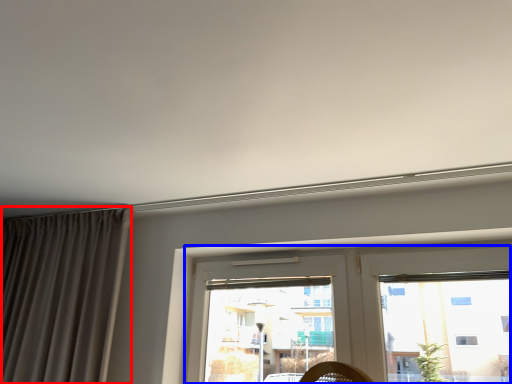
Question: Which point is further to the camera, curtain (highlighted by a red box) or window (highlighted by a blue box)?

Choices:
 (A) curtain
 (B) window

Answer: (A)